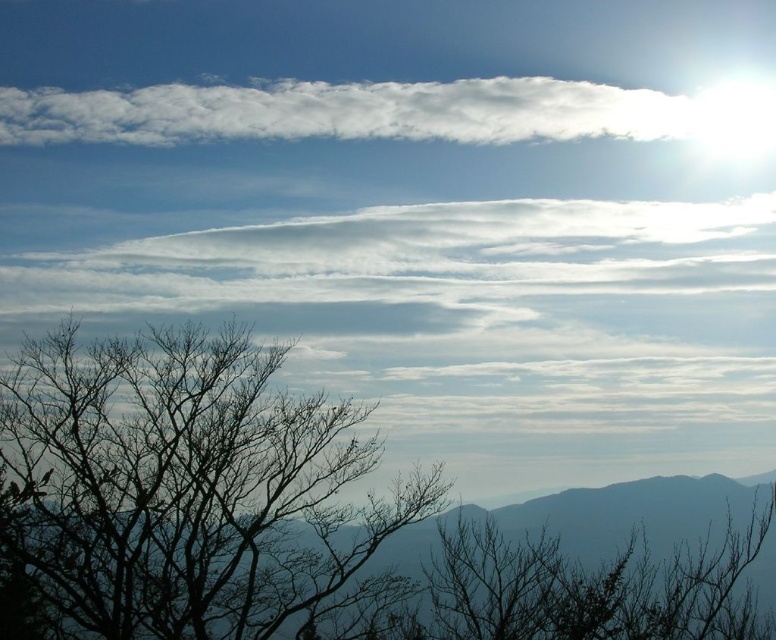
You are an artist trying to paint the scene. You need to decide which object requires more space on your canvas between the black bare tree at left and the white fluffy cloud at upper center. Which one should you allocate more canvas space to?

The white fluffy cloud at upper center requires more canvas space because its width is greater than the black bare tree at left.